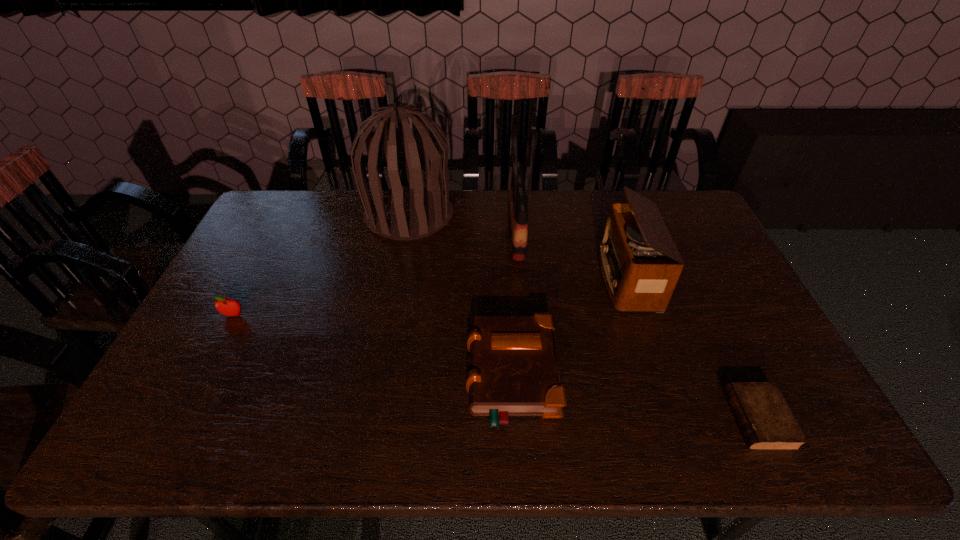
Locate an element on the screen. This screenshot has height=540, width=960. vacant space positioned on the spine side of the shortest object is located at coordinates (690, 419).

Find the location of a particular element. Image resolution: width=960 pixels, height=540 pixels. vacant area situated 0.390m on the spine side of the shortest object is located at coordinates (565, 419).

Identify the location of birdcage at the far edge. (407, 213).

The image size is (960, 540). Find the location of `shopping bag that is at the far edge`. shopping bag that is at the far edge is located at coordinates (517, 208).

Identify the location of Bible at the near edge. The height and width of the screenshot is (540, 960). (513, 371).

Locate an element on the screen. diary positioned at the near edge is located at coordinates (766, 422).

Where is `object located at the left edge`? object located at the left edge is located at coordinates (229, 307).

You are a GUI agent. You are given a task and a screenshot of the screen. Output one action in this format:
    pyautogui.click(x=<x>, y=<y>)
    Task: Click on the object that is positioned at the right edge
    The image size is (960, 540).
    Given the screenshot: What is the action you would take?
    pyautogui.click(x=766, y=422)

At what (x,y) coordinates should I click in order to perform the action: click on object that is at the near right corner. Please return your answer as a coordinate pair (x, y). Looking at the image, I should click on (766, 422).

You are a GUI agent. You are given a task and a screenshot of the screen. Output one action in this format:
    pyautogui.click(x=<x>, y=<y>)
    Task: Click on the free space at the right edge of the desktop
    The image size is (960, 540).
    Given the screenshot: What is the action you would take?
    pyautogui.click(x=728, y=338)